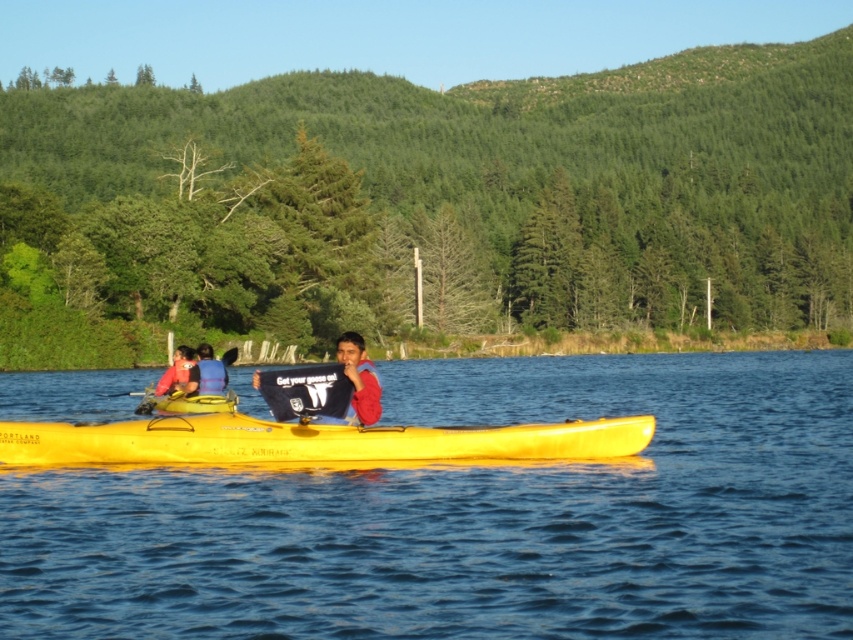
Question: Is matte pink shirt at left in front of yellow plastic paddle at left?

Choices:
 (A) no
 (B) yes

Answer: (B)

Question: Can you confirm if yellow plastic canoe at center is positioned above blue fabric at left?

Choices:
 (A) yes
 (B) no

Answer: (B)

Question: Which object is farther from the camera taking this photo?

Choices:
 (A) yellow plastic kayak at center
 (B) blue fabric at left
 (C) matte blue t-shirt at center
 (D) yellow plastic canoe at center

Answer: (B)

Question: Can you confirm if yellow plastic canoe at center is thinner than blue fabric at left?

Choices:
 (A) no
 (B) yes

Answer: (B)

Question: Among these points, which one is farthest from the camera?

Choices:
 (A) (350, 360)
 (B) (190, 365)

Answer: (B)

Question: Which point is farther to the camera?

Choices:
 (A) blue fabric at left
 (B) yellow plastic canoe at center
 (C) yellow plastic paddle at left
 (D) matte pink shirt at left

Answer: (C)